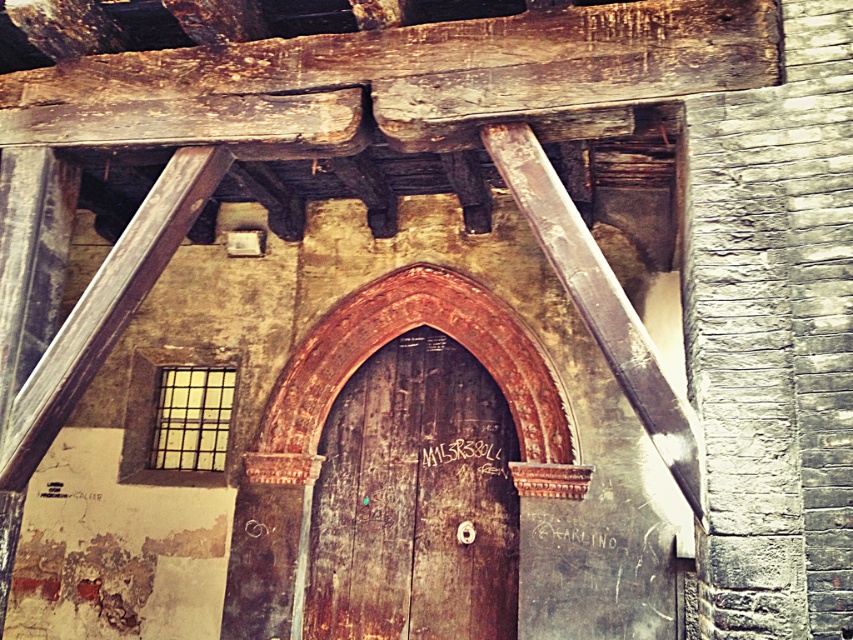
Does rusty wood door at center have a lesser height compared to rusty metal beam at upper center?

In fact, rusty wood door at center may be taller than rusty metal beam at upper center.

Where is `rusty wood door at center`? The height and width of the screenshot is (640, 853). rusty wood door at center is located at coordinates (415, 500).

Can you confirm if wooden beam at left is smaller than rusty metal beam at upper center?

Correct, wooden beam at left occupies less space than rusty metal beam at upper center.

Is point (224, 161) positioned after point (566, 212)?

That is True.

Where is `wooden beam at left`? The image size is (853, 640). wooden beam at left is located at coordinates (106, 307).

Can you confirm if rusty wood door at center is positioned to the left of wooden beam at left?

Incorrect, rusty wood door at center is not on the left side of wooden beam at left.

Describe the element at coordinates (415, 500) in the screenshot. I see `rusty wood door at center` at that location.

Based on the photo, who is more distant from viewer, (410,525) or (68,362)?

The point (410,525) is behind.

Find the location of a particular element. Image resolution: width=853 pixels, height=640 pixels. rusty wood door at center is located at coordinates (415, 500).